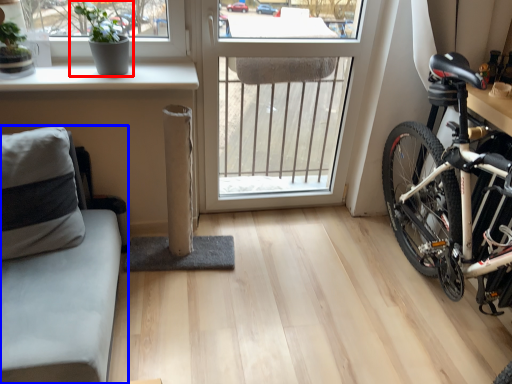
Question: Among these objects, which one is farthest to the camera, houseplant (highlighted by a red box) or studio couch (highlighted by a blue box)?

Choices:
 (A) houseplant
 (B) studio couch

Answer: (A)